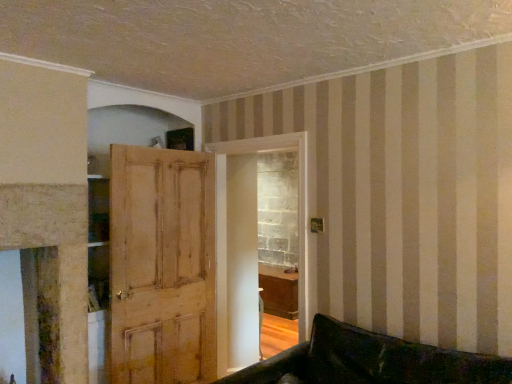
At what (x,y) coordinates should I click in order to perform the action: click on light brown wooden door at center. Please return your answer as a coordinate pair (x, y). The image size is (512, 384). Looking at the image, I should click on (162, 266).

What do you see at coordinates (162, 266) in the screenshot? I see `light brown wooden door at center` at bounding box center [162, 266].

You are a GUI agent. You are given a task and a screenshot of the screen. Output one action in this format:
    pyautogui.click(x=<x>, y=<y>)
    Task: Click on the light brown wooden door at center
    
    Given the screenshot: What is the action you would take?
    pyautogui.click(x=162, y=266)